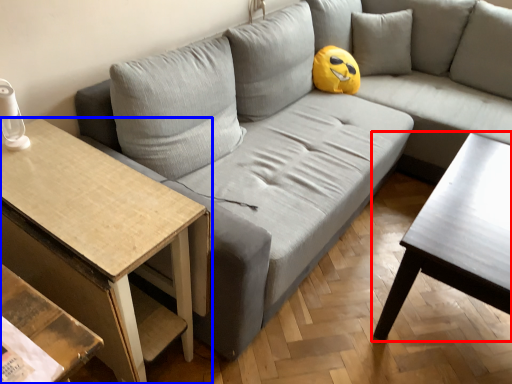
Question: Which of the following is the closest to the observer, coffee table (highlighted by a red box) or table (highlighted by a blue box)?

Choices:
 (A) coffee table
 (B) table

Answer: (B)